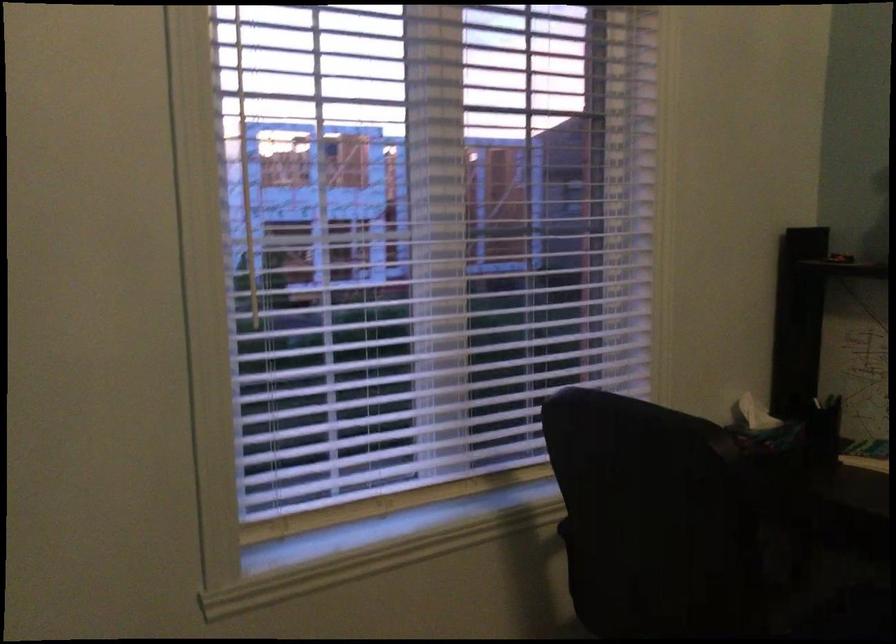
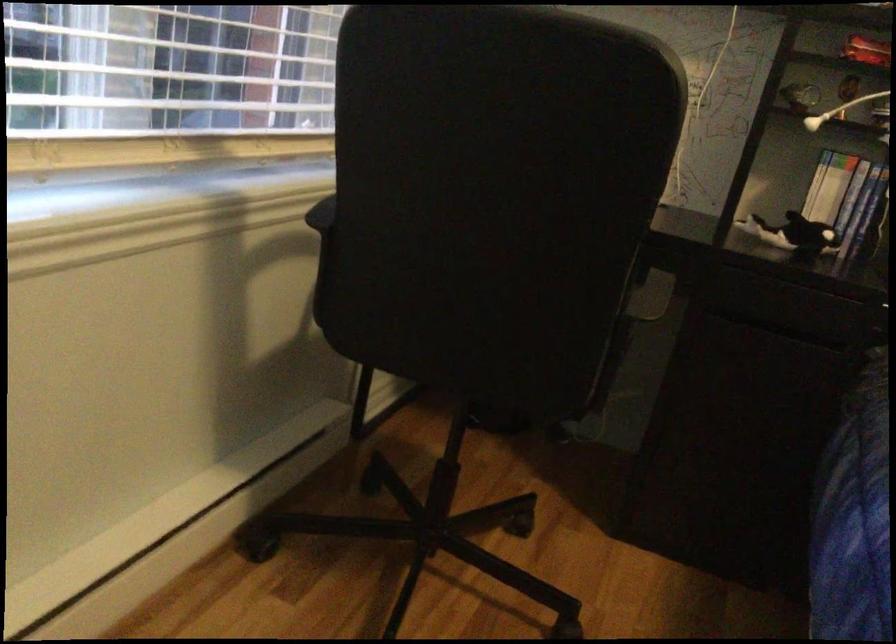
Question: The camera is either moving clockwise (left) or counter-clockwise (right) around the object. The first image is from the beginning of the video and the second image is from the end. Is the camera moving left or right when shooting the video?

Choices:
 (A) Left
 (B) Right

Answer: (A)